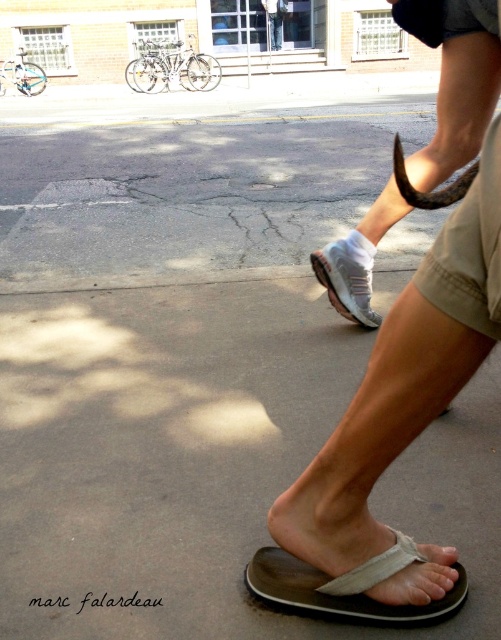
Question: Which object is closer to the camera taking this photo?

Choices:
 (A) white fabric sock at upper center
 (B) gray fabric sandal at lower center
 (C) white mesh shoe at center

Answer: (B)

Question: Can you confirm if gray fabric sandal at lower center is bigger than white mesh shoe at center?

Choices:
 (A) no
 (B) yes

Answer: (A)

Question: Is white fabric sock at upper center above white mesh shoe at center?

Choices:
 (A) no
 (B) yes

Answer: (B)

Question: Which point appears closest to the camera in this image?

Choices:
 (A) (314, 262)
 (B) (339, 248)

Answer: (B)

Question: Does white fabric sock at upper center appear on the left side of gray fabric sandal at lower center?

Choices:
 (A) no
 (B) yes

Answer: (A)

Question: Which point is farther from the camera taking this photo?

Choices:
 (A) (376, 321)
 (B) (319, 570)
 (C) (394, 182)

Answer: (A)